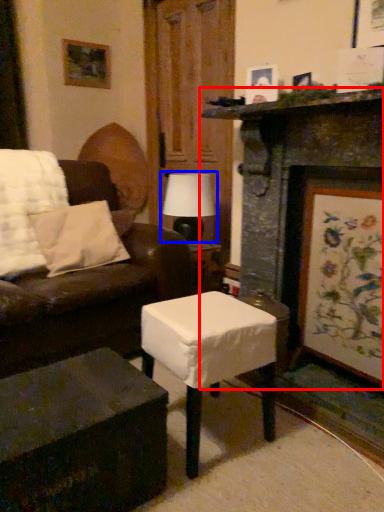
Question: Which object is closer to the camera taking this photo, fireplace (highlighted by a red box) or table lamp (highlighted by a blue box)?

Choices:
 (A) fireplace
 (B) table lamp

Answer: (A)